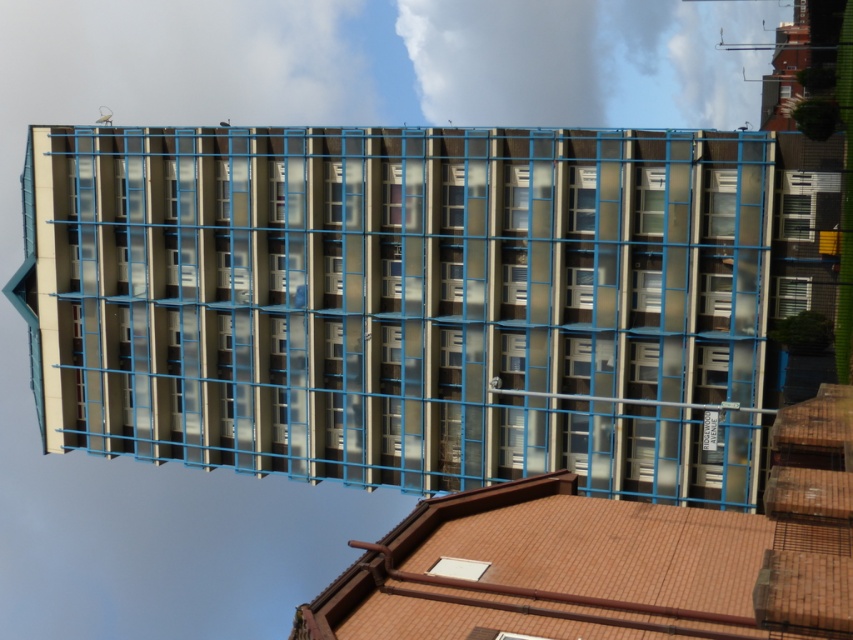
You are standing in front of the tall residential building and want to know which window you can see more clearly. Which one is closer to you between the clear glass window at right and the white textured window at right?

The clear glass window at right is closer to the viewer than the white textured window at right, so you can see it more clearly.

Consider the image. You are an architect reviewing blueprints for a building. You notice two windows on the right side of the facade, a clear glass window at right and a white textured window at right. Which one has a greater height?

The clear glass window at right is taller than the white textured window at right according to the description.

You are standing in front of the tall residential building with blue metal framework. You see a point at coordinate (796, 216). What object is located at that point?

The point at coordinate (796, 216) indicates a clear glass window at right.